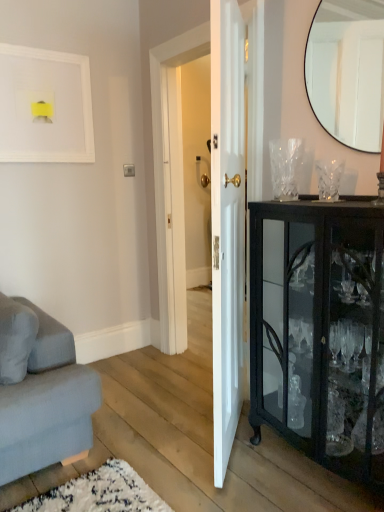
Question: In the image, is black glass cabinet at right on the left side or the right side of white glossy door at center?

Choices:
 (A) left
 (B) right

Answer: (B)

Question: Is black glass cabinet at right bigger or smaller than white glossy door at center?

Choices:
 (A) big
 (B) small

Answer: (A)

Question: Which object is positioned closest to the white glossy door at center?

Choices:
 (A) matte black mirror at upper right
 (B) white matte picture frame at upper left
 (C) black glass cabinet at right

Answer: (C)

Question: Which object is positioned closest to the matte black mirror at upper right?

Choices:
 (A) white matte picture frame at upper left
 (B) white glossy door at center
 (C) black glass cabinet at right

Answer: (B)